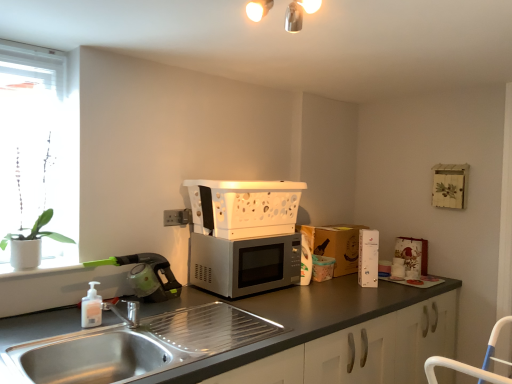
Question: From a real-world perspective, is white matte soap dispenser at sink left positioned over satin silver microwave at center based on gravity?

Choices:
 (A) yes
 (B) no

Answer: (B)

Question: From the image's perspective, does white matte soap dispenser at sink left appear lower than satin silver microwave at center?

Choices:
 (A) no
 (B) yes

Answer: (B)

Question: Is white matte soap dispenser at sink left positioned far away from satin silver microwave at center?

Choices:
 (A) no
 (B) yes

Answer: (A)

Question: Considering the relative positions of white matte soap dispenser at sink left and satin silver microwave at center in the image provided, is white matte soap dispenser at sink left to the right of satin silver microwave at center from the viewer's perspective?

Choices:
 (A) no
 (B) yes

Answer: (A)

Question: Can you confirm if white matte soap dispenser at sink left is bigger than satin silver microwave at center?

Choices:
 (A) no
 (B) yes

Answer: (A)

Question: Considering the relative positions of satin silver microwave at center and stainless steel sink at lower left in the image provided, is satin silver microwave at center to the left or to the right of stainless steel sink at lower left?

Choices:
 (A) left
 (B) right

Answer: (B)

Question: Is satin silver microwave at center bigger or smaller than stainless steel sink at lower left?

Choices:
 (A) big
 (B) small

Answer: (B)

Question: Does point (259, 248) appear closer or farther from the camera than point (54, 379)?

Choices:
 (A) farther
 (B) closer

Answer: (A)

Question: Considering the positions of satin silver microwave at center and stainless steel sink at lower left in the image, is satin silver microwave at center wider or thinner than stainless steel sink at lower left?

Choices:
 (A) thin
 (B) wide

Answer: (A)

Question: From a real-world perspective, relative to green plastic vacuum cleaner at left, the first appliance positioned from the left, is matte gray countertop at center vertically above or below?

Choices:
 (A) above
 (B) below

Answer: (B)

Question: Is point (190, 360) closer or farther from the camera than point (141, 253)?

Choices:
 (A) farther
 (B) closer

Answer: (B)

Question: From the image's perspective, is matte gray countertop at center above or below green plastic vacuum cleaner at left, the first appliance positioned from the left?

Choices:
 (A) above
 (B) below

Answer: (B)

Question: Visually, is matte gray countertop at center positioned to the left or to the right of green plastic vacuum cleaner at left, the first appliance positioned from the left?

Choices:
 (A) left
 (B) right

Answer: (B)

Question: From the image's perspective, is white matte plant at left above or below brown cardboard box at right?

Choices:
 (A) above
 (B) below

Answer: (A)

Question: Looking at the image, does white matte plant at left seem bigger or smaller compared to brown cardboard box at right?

Choices:
 (A) big
 (B) small

Answer: (A)